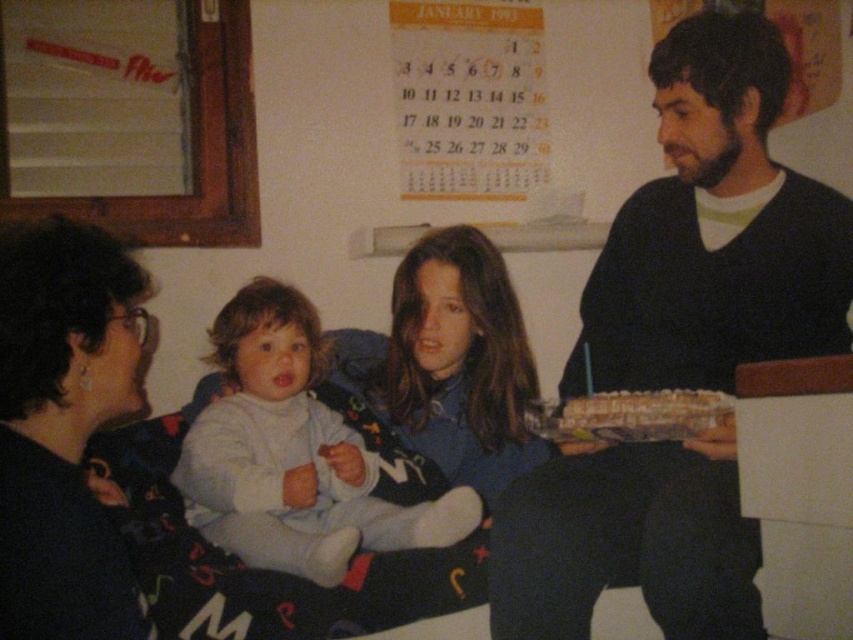
In the scene, there are two items with dark blue color. The dark blue sweater at center and the dark blue fabric at left. Which one is positioned more to the right?

The dark blue sweater at center is positioned to the right of the dark blue fabric at left.

You are a photographer standing at the current position. You want to take a clear photo of the light blue fabric baby at center. What is the minimum distance you need to maintain between the camera and the baby to ensure the photo is in focus?

The minimum distance you need to maintain between the camera and the light blue fabric baby at center is 1.35 meters to ensure the photo is in focus.

You are a photographer trying to capture a closeup of the light blue fabric baby at center without the dark blue sweater at center blocking the view. Can you adjust your position to do this?

The dark blue sweater at center is bigger than the light blue fabric baby at center, so it might block the view. Move closer to the light blue fabric baby at center to avoid the obstruction caused by the larger dark blue sweater at center.